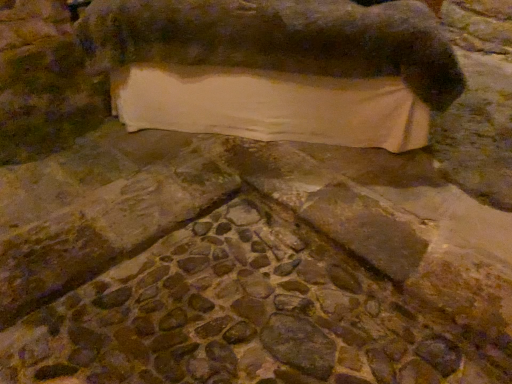
Describe the element at coordinates (279, 39) in the screenshot. I see `smooth beige cloth at center` at that location.

In order to click on smooth beige cloth at center in this screenshot , I will do `click(279, 39)`.

At what (x,y) coordinates should I click in order to perform the action: click on smooth beige cloth at center. Please return your answer as a coordinate pair (x, y). This screenshot has height=384, width=512. Looking at the image, I should click on (279, 39).